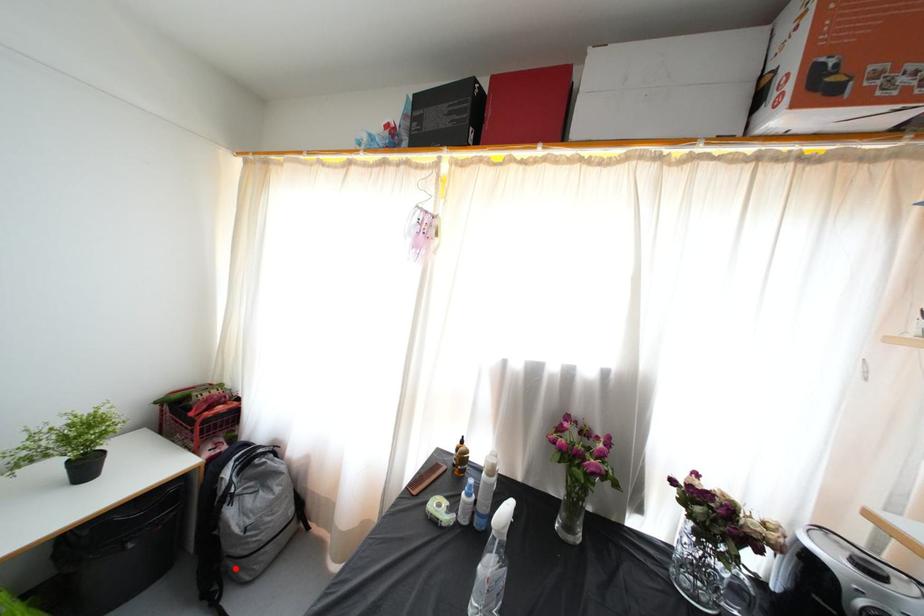
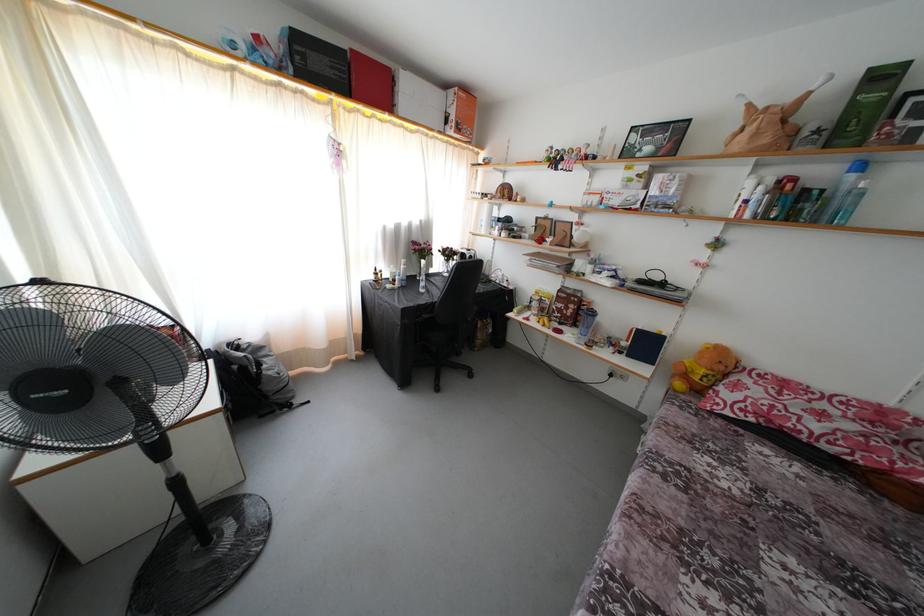
Where in the second image is the point corresponding to the highlighted location from the first image?

(281, 403)